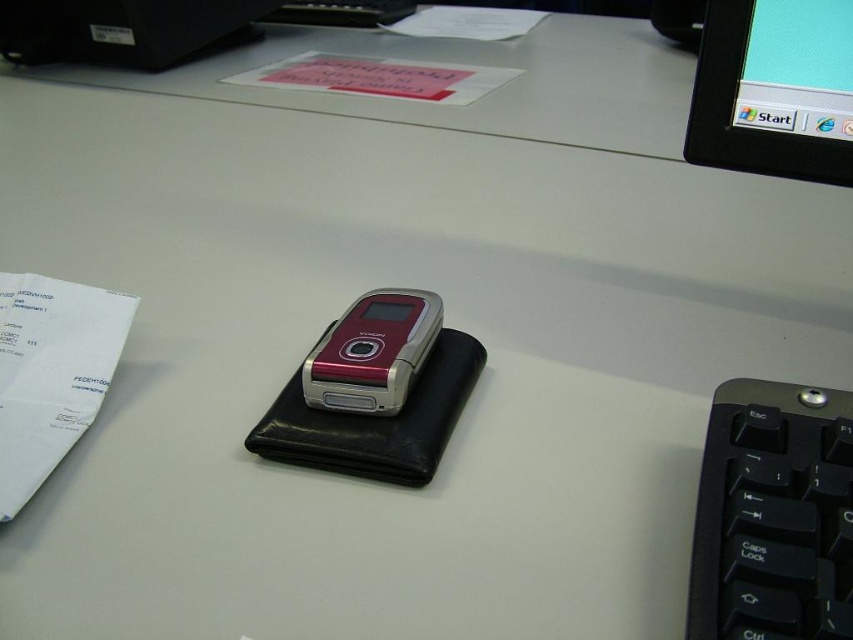
Question: Where is black glossy monitor at upper right located in relation to white paper at left in the image?

Choices:
 (A) below
 (B) above

Answer: (B)

Question: Can you confirm if black glossy monitor at upper right is positioned to the right of metallic red phone at center?

Choices:
 (A) yes
 (B) no

Answer: (A)

Question: Which of the following is the farthest from the observer?

Choices:
 (A) black glossy monitor at upper right
 (B) metallic red phone at center

Answer: (A)

Question: Is white paper at left behind metallic red phone at center?

Choices:
 (A) no
 (B) yes

Answer: (A)

Question: Considering the real-world distances, which object is closest to the black glossy monitor at upper right?

Choices:
 (A) black plastic keyboard at lower right
 (B) metallic red phone at center

Answer: (A)

Question: Which object is closer to the camera taking this photo?

Choices:
 (A) metallic red phone at center
 (B) white paper at left
 (C) black plastic keyboard at lower right

Answer: (C)